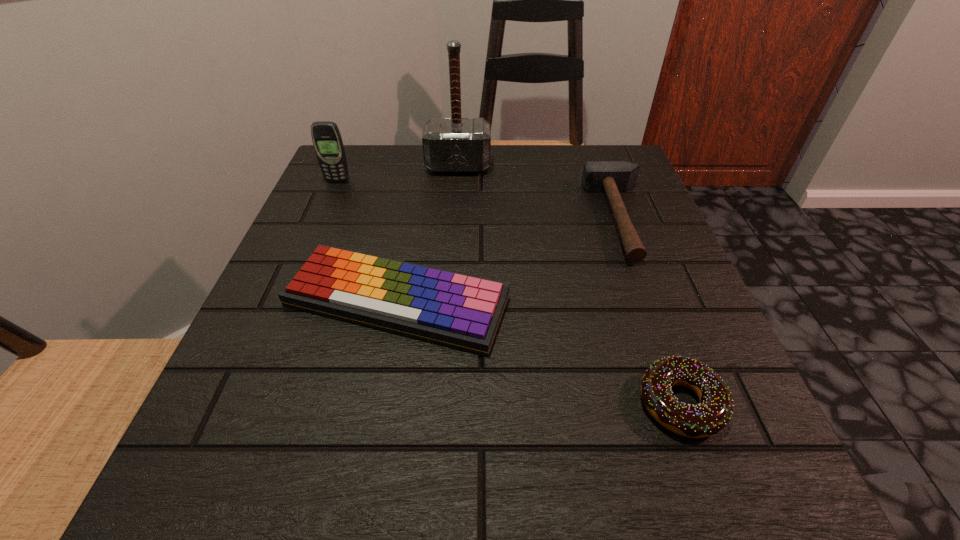
Identify which object is the second closest to the left hammer. Please provide its 2D coordinates. Your answer should be formatted as a tuple, i.e. [(x, y)], where the tuple contains the x and y coordinates of a point satisfying the conditions above.

[(612, 177)]

Identify the location of free spot that satisfies the following two spatial constraints: 1. on the screen of the second tallest object; 2. on the left side of the computer keyboard. (286, 302).

Image resolution: width=960 pixels, height=540 pixels. In order to click on vacant space that satisfies the following two spatial constraints: 1. on the screen of the computer keyboard; 2. on the left side of the fourth shortest object in this screenshot , I will do `click(286, 302)`.

Identify the location of free spot that satisfies the following two spatial constraints: 1. on the screen of the nearest object; 2. on the left side of the second tallest object. (243, 403).

Image resolution: width=960 pixels, height=540 pixels. In order to click on vacant space that satisfies the following two spatial constraints: 1. on the screen of the cellular telephone; 2. on the left side of the doughnut in this screenshot , I will do `click(243, 403)`.